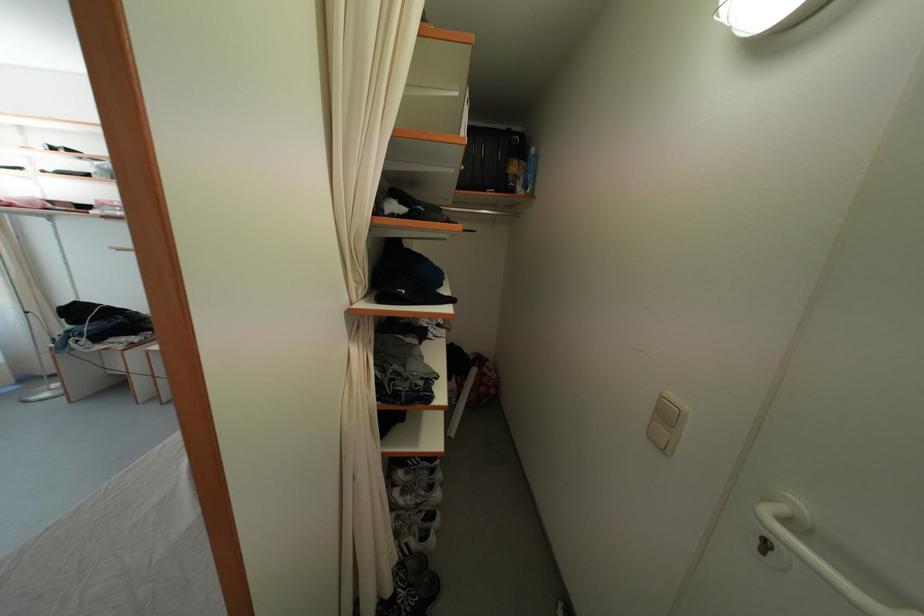
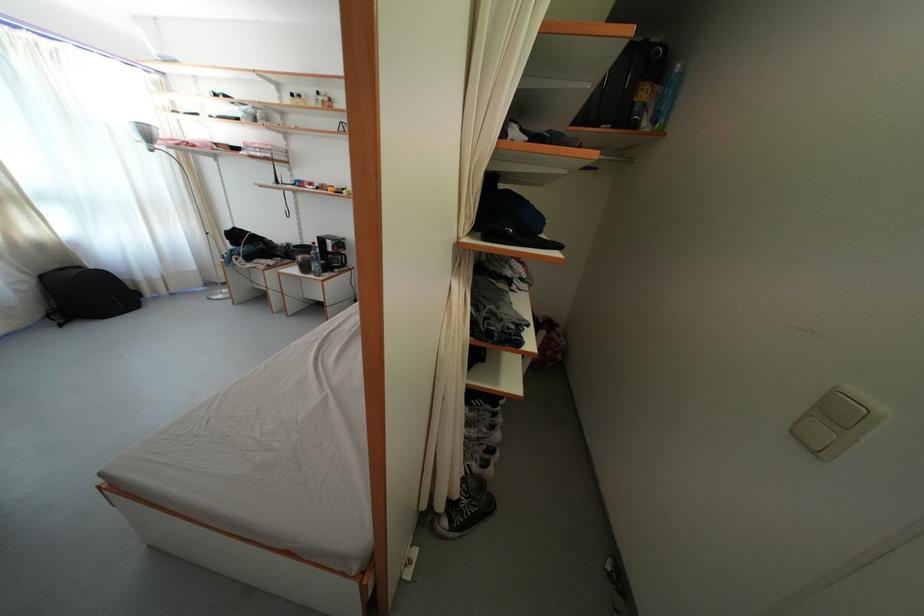
Question: What movement of the cameraman would produce the second image?

Choices:
 (A) Left
 (B) Right
 (C) Forward
 (D) Backward

Answer: (A)